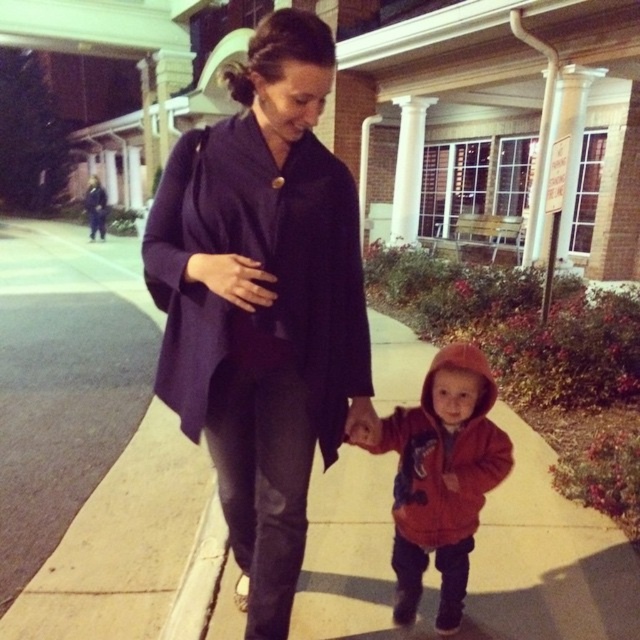
Question: Which point is closer to the camera taking this photo?

Choices:
 (A) (211, 179)
 (B) (218, 513)
 (C) (444, 632)

Answer: (A)

Question: Where is matte orange hoodie at center located in relation to concrete at lower left in the image?

Choices:
 (A) below
 (B) above

Answer: (B)

Question: Which is nearer to the matte orange hoodie at center?

Choices:
 (A) concrete at lower left
 (B) dark purple woolen coat at center

Answer: (B)

Question: Among these objects, which one is farthest from the camera?

Choices:
 (A) matte orange hoodie at center
 (B) concrete at lower left
 (C) dark purple woolen coat at center

Answer: (B)

Question: Does dark purple woolen coat at center appear on the right side of concrete at lower left?

Choices:
 (A) yes
 (B) no

Answer: (A)

Question: Observing the image, what is the correct spatial positioning of matte orange hoodie at center in reference to concrete at lower left?

Choices:
 (A) above
 (B) below

Answer: (A)